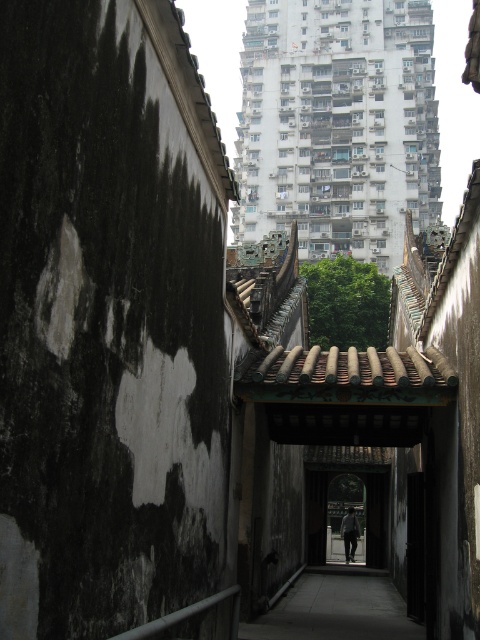
You are a delivery robot with a 1.2 meter wide package. You need to navigate through the narrow alleyway in the image. Is the smooth concrete path at center wide enough to carry your package through?

The smooth concrete path at center is located at point coordinates of [336,609]. However, the width of the path is not provided in the object description, so it is impossible to determine if it can accommodate a 1.2 meter wide package.

Looking at this image, you are a delivery person carrying a package that is 2 meters long. You need to navigate through the narrow alleyway shown in the image. The alley has a smooth concrete path at center and a dark gray fabric at center. Can you safely pass through the alley without the package hitting anything?

The distance between the smooth concrete path at center and the dark gray fabric at center is 19.95 meters. Since your package is only 2 meters long, there is sufficient space for you to pass through the alley without any issues.